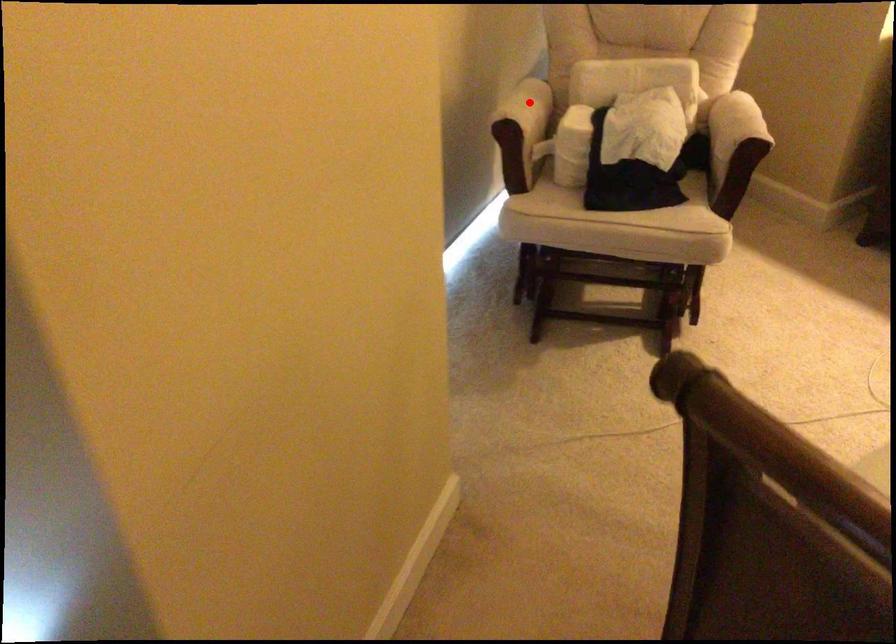
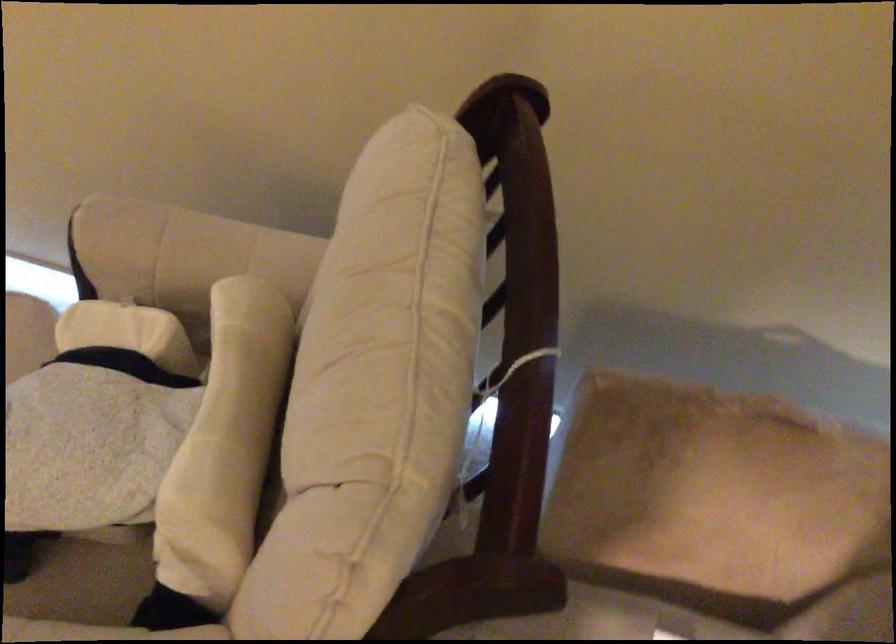
The point at the highlighted location is marked in the first image. Where is the corresponding point in the second image?

(181, 250)